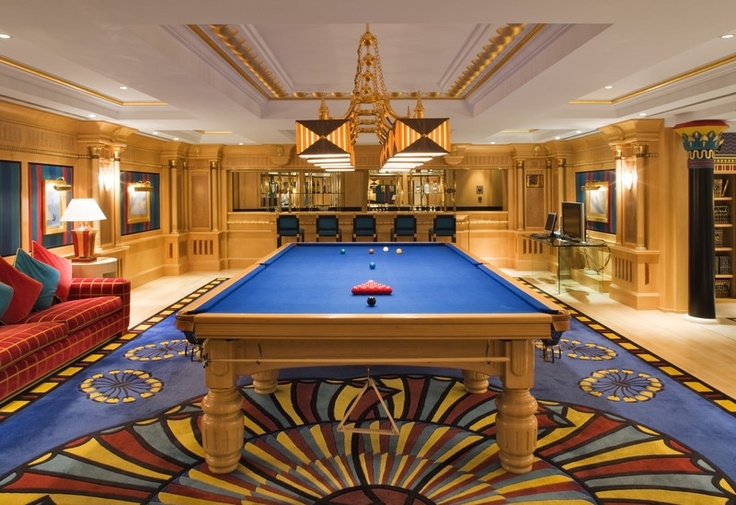
Where is `pool stick`? pool stick is located at coordinates (336, 360).